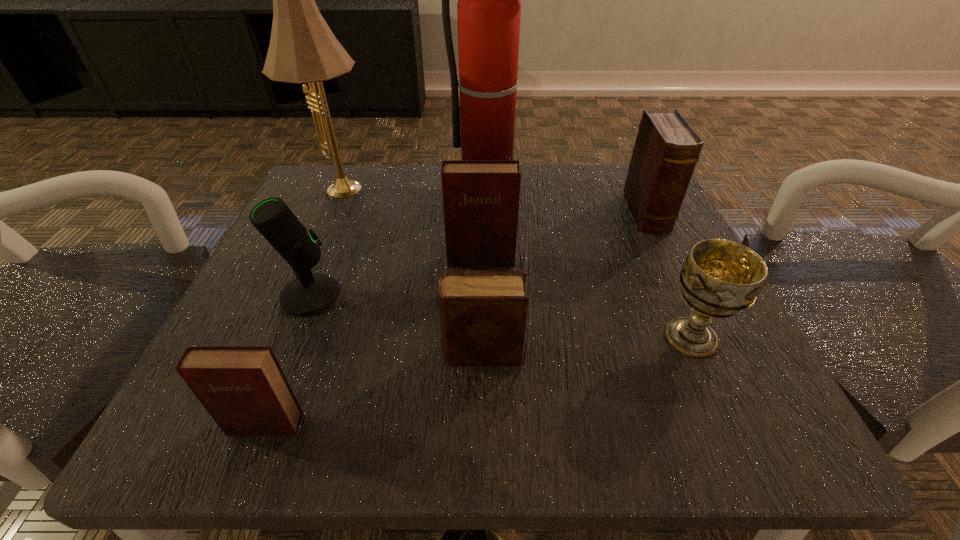
Locate an element on the screen. The height and width of the screenshot is (540, 960). diary identified as the closest to the beige lampshade is located at coordinates click(x=480, y=197).

Identify the location of the third closest diary relative to the right brown diary. (243, 388).

Image resolution: width=960 pixels, height=540 pixels. Identify the location of vacant area in the image that satisfies the following two spatial constraints: 1. with the nozzle and gauge on the chalice; 2. on the left side of the fire extinguisher. 494,337.